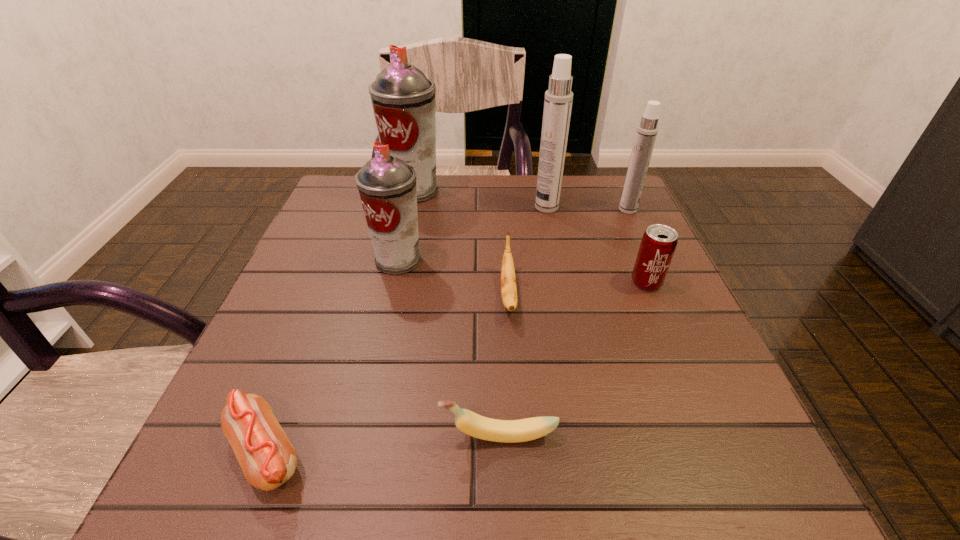
At what (x,y) coordinates should I click in order to perform the action: click on vacant space located 0.200m at the stem of the nearer yellow banana. Please return your answer as a coordinate pair (x, y). The height and width of the screenshot is (540, 960). Looking at the image, I should click on (306, 436).

Locate an element on the screen. free space located on the right of the brown sausage is located at coordinates (561, 453).

Find the location of `object present at the near edge`. object present at the near edge is located at coordinates (268, 459).

Locate an element on the screen. The height and width of the screenshot is (540, 960). aerosol can that is at the left edge is located at coordinates (403, 99).

The width and height of the screenshot is (960, 540). In order to click on sausage that is at the left edge in this screenshot , I will do `click(268, 459)`.

This screenshot has height=540, width=960. Find the location of `aerosol can that is at the right edge`. aerosol can that is at the right edge is located at coordinates (647, 130).

The height and width of the screenshot is (540, 960). Find the location of `beer can situated at the right edge`. beer can situated at the right edge is located at coordinates (658, 244).

Where is `object that is at the far left corner`? The image size is (960, 540). object that is at the far left corner is located at coordinates (403, 99).

Find the location of a particular element. object located at the near left corner is located at coordinates (268, 459).

I want to click on object at the far right corner, so click(x=647, y=130).